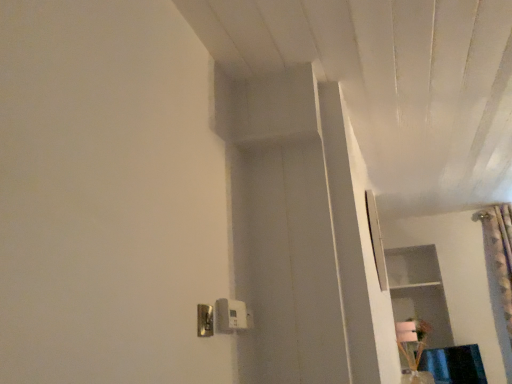
Question: Should I look upward or downward to see metallic silver light switch at lower center, marked as the first light switch in a front-to-back arrangement?

Choices:
 (A) up
 (B) down

Answer: (B)

Question: Could you tell me if metallic silver light switch at lower center, marked as the first light switch in a front-to-back arrangement, is turned towards white plastic light switch at lower center, the 2th light switch when ordered from front to back?

Choices:
 (A) yes
 (B) no

Answer: (B)

Question: From the image's perspective, would you say metallic silver light switch at lower center, which is the 2th light switch in back-to-front order, is shown under white plastic light switch at lower center, which is the first light switch in back-to-front order?

Choices:
 (A) no
 (B) yes

Answer: (A)

Question: Can you confirm if metallic silver light switch at lower center, which is the 2th light switch in back-to-front order, is taller than white plastic light switch at lower center, which is the first light switch in back-to-front order?

Choices:
 (A) yes
 (B) no

Answer: (B)

Question: From a real-world perspective, does metallic silver light switch at lower center, marked as the first light switch in a front-to-back arrangement, sit lower than white plastic light switch at lower center, the 2th light switch when ordered from front to back?

Choices:
 (A) yes
 (B) no

Answer: (A)

Question: Can white plastic light switch at lower center, which is the first light switch in back-to-front order, be found inside metallic silver light switch at lower center, which is the 2th light switch in back-to-front order?

Choices:
 (A) yes
 (B) no

Answer: (B)

Question: From a real-world perspective, is metallic silver light switch at lower center, which is the 2th light switch in back-to-front order, on white plastic light switch at lower center, which is the first light switch in back-to-front order?

Choices:
 (A) yes
 (B) no

Answer: (B)

Question: Is white plastic light switch at lower center, which is the first light switch in back-to-front order, positioned with its back to metallic silver light switch at lower center, which is the 2th light switch in back-to-front order?

Choices:
 (A) yes
 (B) no

Answer: (B)

Question: Considering the relative sizes of white plastic light switch at lower center, which is the first light switch in back-to-front order, and metallic silver light switch at lower center, marked as the first light switch in a front-to-back arrangement, in the image provided, is white plastic light switch at lower center, which is the first light switch in back-to-front order, wider than metallic silver light switch at lower center, marked as the first light switch in a front-to-back arrangement,?

Choices:
 (A) no
 (B) yes

Answer: (B)

Question: Is white plastic light switch at lower center, the 2th light switch when ordered from front to back, beside metallic silver light switch at lower center, which is the 2th light switch in back-to-front order?

Choices:
 (A) yes
 (B) no

Answer: (A)

Question: Is white plastic light switch at lower center, the 2th light switch when ordered from front to back, shorter than metallic silver light switch at lower center, marked as the first light switch in a front-to-back arrangement?

Choices:
 (A) yes
 (B) no

Answer: (B)

Question: From the image's perspective, is white plastic light switch at lower center, the 2th light switch when ordered from front to back, on metallic silver light switch at lower center, which is the 2th light switch in back-to-front order?

Choices:
 (A) no
 (B) yes

Answer: (A)

Question: Can you confirm if white plastic light switch at lower center, the 2th light switch when ordered from front to back, is smaller than metallic silver light switch at lower center, which is the 2th light switch in back-to-front order?

Choices:
 (A) yes
 (B) no

Answer: (B)

Question: Would you say white plastic light switch at lower center, the 2th light switch when ordered from front to back, is inside or outside metallic silver light switch at lower center, which is the 2th light switch in back-to-front order?

Choices:
 (A) inside
 (B) outside

Answer: (B)